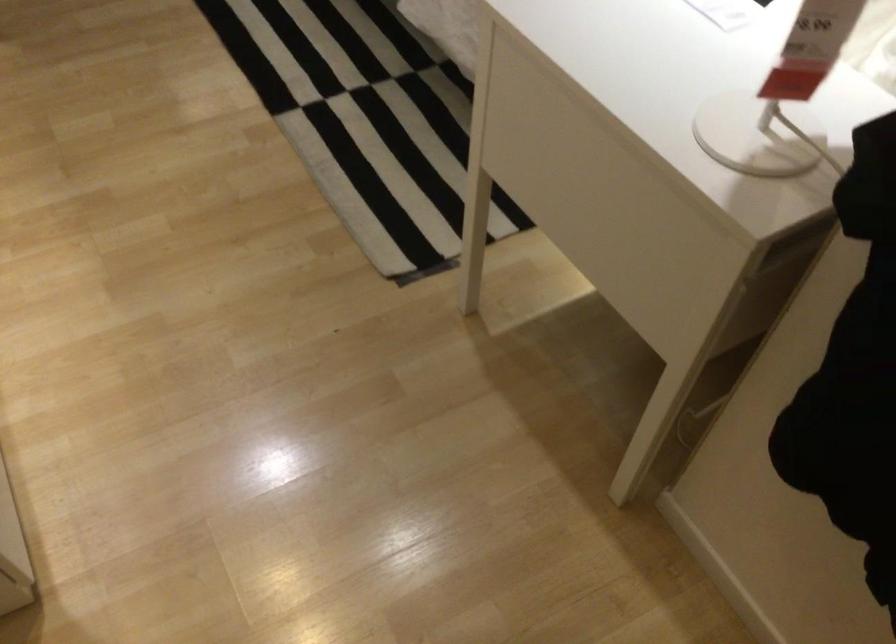
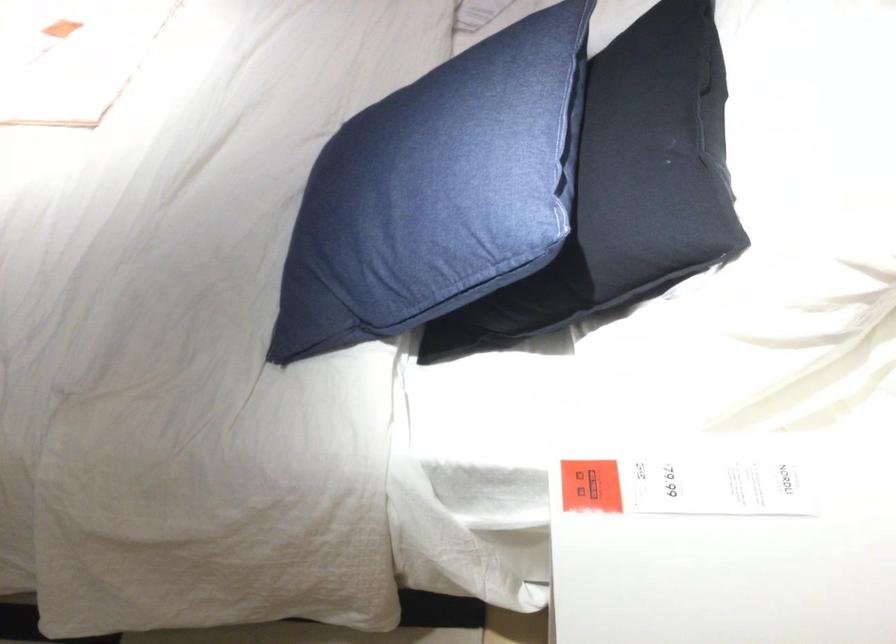
Question: The first image is from the beginning of the video and the second image is from the end. How did the camera likely rotate when shooting the video?

Choices:
 (A) Left
 (B) Right
 (C) Up
 (D) Down

Answer: (B)